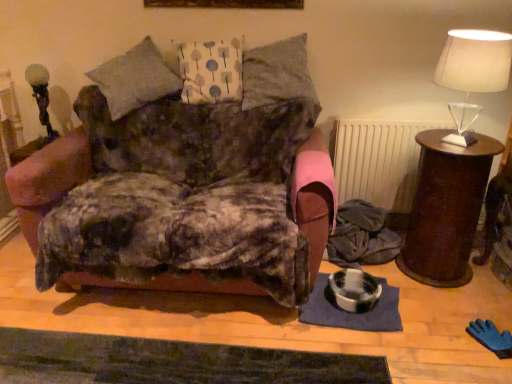
Where is `vacant space in translucent glass table lamp at upper right, which is the 2th table lamp in left-to-right order (from a real-world perspective)`? vacant space in translucent glass table lamp at upper right, which is the 2th table lamp in left-to-right order (from a real-world perspective) is located at coordinates (457, 138).